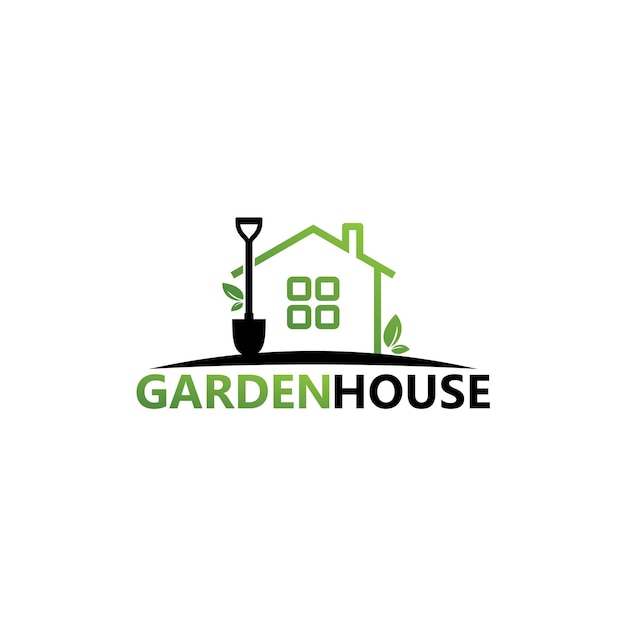
Locate an element on the screen. The height and width of the screenshot is (626, 626). window is located at coordinates (300, 317), (300, 290), (327, 283), (327, 317).